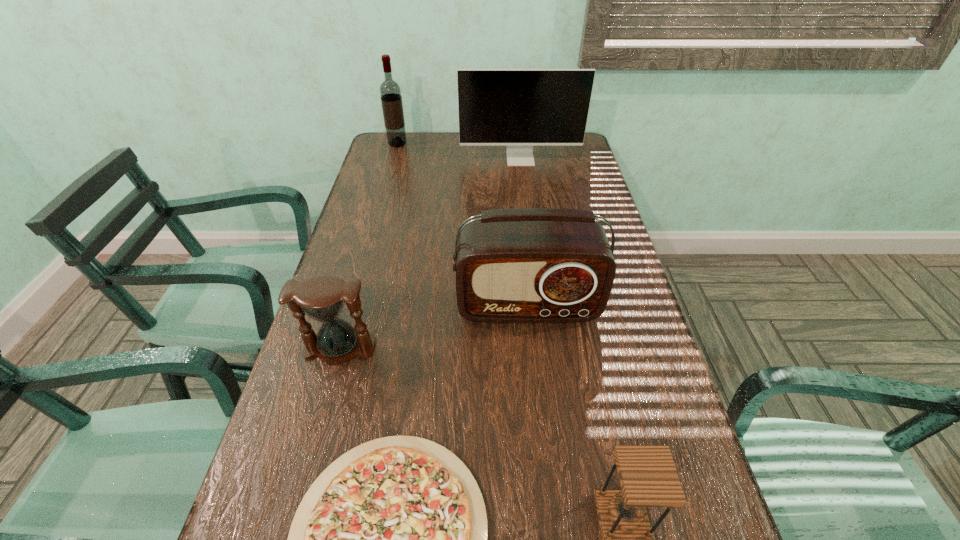
This screenshot has width=960, height=540. Find the location of `free space at the far left corner`. free space at the far left corner is located at coordinates (375, 152).

Find the location of a particular element. This screenshot has width=960, height=540. free spot between the monitor and the farthest object is located at coordinates (459, 151).

Where is `blank region between the fourth nearest object and the left hourglass`? blank region between the fourth nearest object and the left hourglass is located at coordinates (434, 327).

Identify the location of empty location between the wine bottle and the monitor. (459, 151).

The image size is (960, 540). Identify the location of free space that is in between the fourth farthest object and the wine bottle. (369, 246).

Find the location of a particular element. Image resolution: width=960 pixels, height=540 pixels. the closest object relative to the shortest object is located at coordinates (322, 298).

Locate which object ranks second in proximity to the right hourglass. Please provide its 2D coordinates. Your answer should be formatted as a tuple, i.e. [(x, y)], where the tuple contains the x and y coordinates of a point satisfying the conditions above.

[(523, 265)]